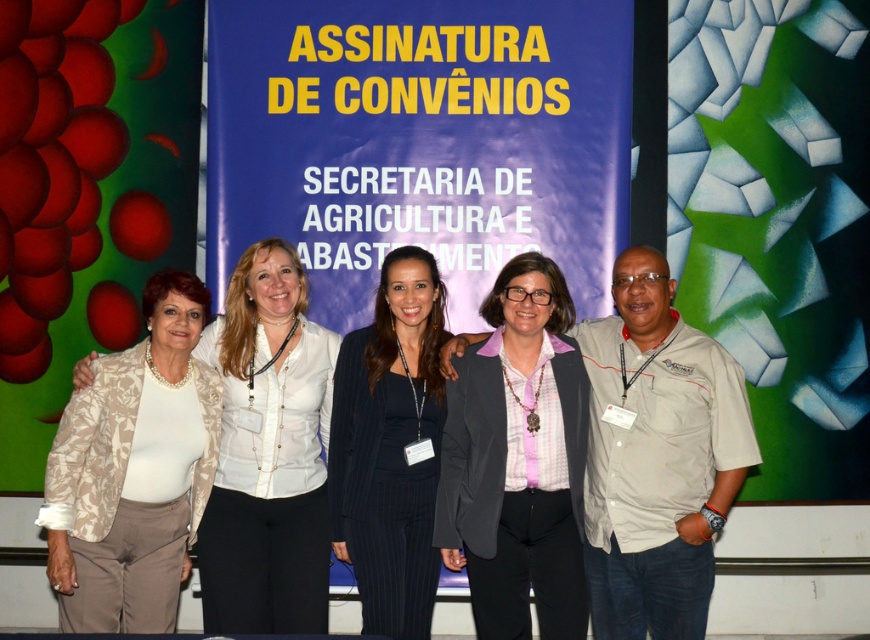
You are a photographer adjusting your camera settings to focus on two specific points in the scene. The points are labeled as point (184, 416) and point (261, 618). Which point is closer to your camera lens?

Point (184, 416) is further to the camera than point (261, 618), so the point closer to the camera lens is point (261, 618).